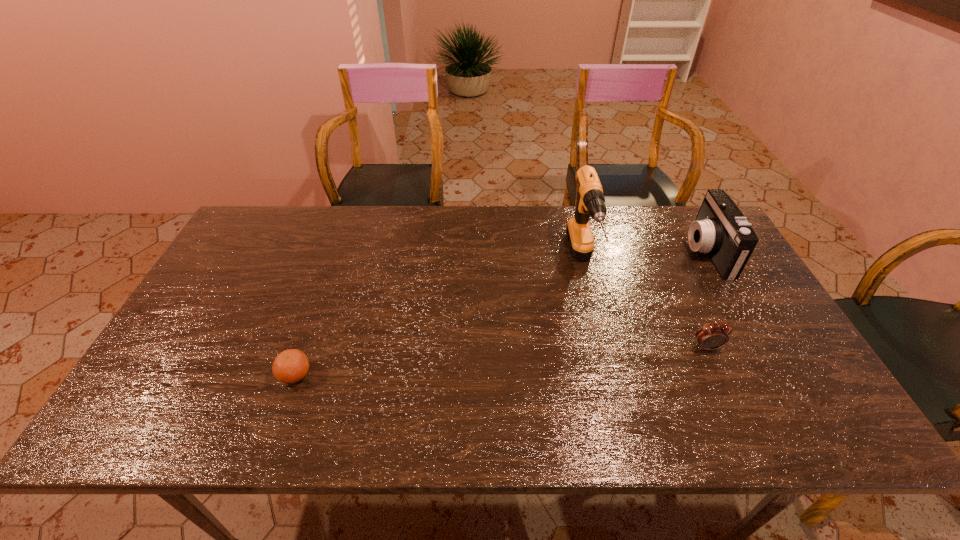
You are a GUI agent. You are given a task and a screenshot of the screen. Output one action in this format:
    pyautogui.click(x=<x>, y=<y>)
    Task: Click on the empty location between the second object from right to left and the rightmost object
    The image size is (960, 540).
    Given the screenshot: What is the action you would take?
    pyautogui.click(x=707, y=300)

Where is `object that stands as the third closest to the tallest object`? This screenshot has height=540, width=960. object that stands as the third closest to the tallest object is located at coordinates (290, 366).

At what (x,y) coordinates should I click in order to perform the action: click on the third closest object to the nearest object. Please return your answer as a coordinate pair (x, y). The image size is (960, 540). Looking at the image, I should click on (720, 229).

Find the location of a particular element. The width and height of the screenshot is (960, 540). vacant space that satisfies the following two spatial constraints: 1. on the lens of the second tallest object; 2. on the face of the second nearest object is located at coordinates (760, 347).

Identify the location of free spot that satisfies the following two spatial constraints: 1. on the lens of the camcorder; 2. at the tip of the tallest object. This screenshot has height=540, width=960. (712, 263).

At what (x,y) coordinates should I click in order to perform the action: click on vacant point that satisfies the following two spatial constraints: 1. on the lens of the rightmost object; 2. on the front side of the clementine. Please return your answer as a coordinate pair (x, y). The width and height of the screenshot is (960, 540). Looking at the image, I should click on (776, 374).